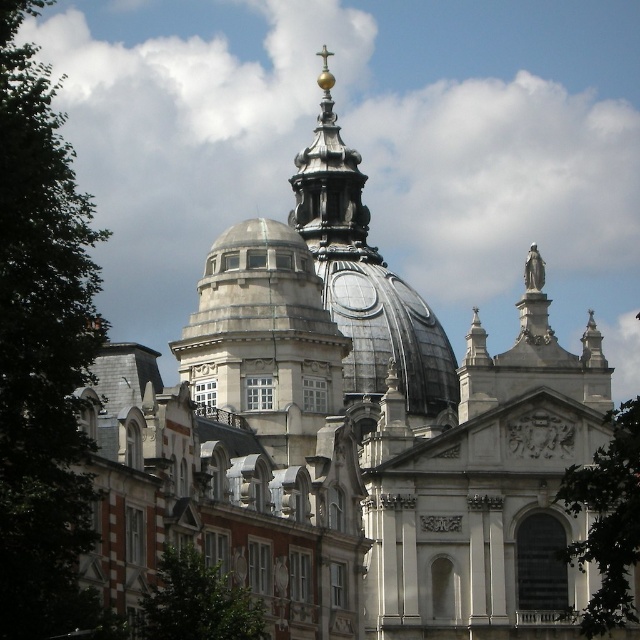
Is point (300, 291) positioned behind point (348, 244)?

That is False.

Is point (252, 292) behind point (291, 218)?

No, (252, 292) is closer to viewer.

The width and height of the screenshot is (640, 640). Identify the location of silver metallic dome at center. (264, 339).